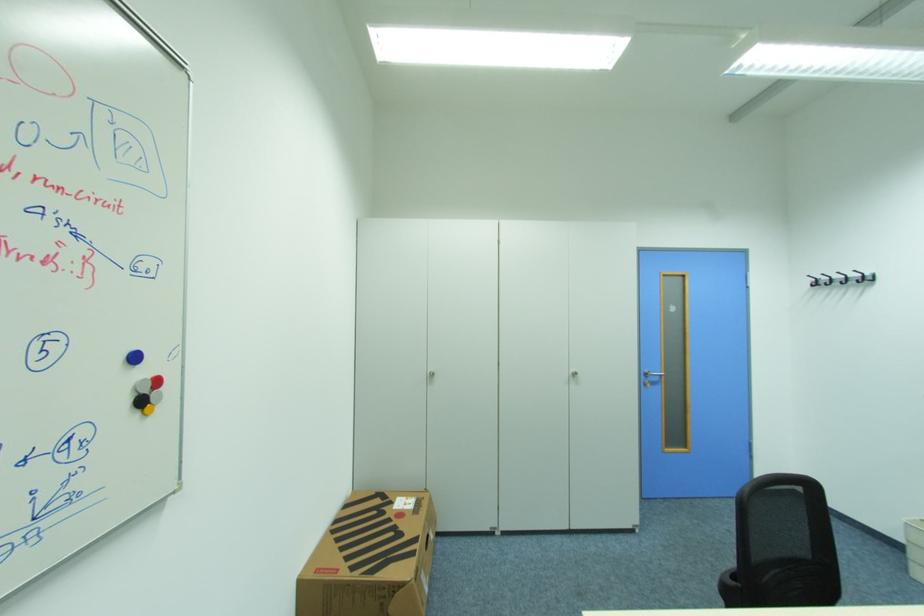
You are a GUI agent. You are given a task and a screenshot of the screen. Output one action in this format:
    pyautogui.click(x=<x>, y=<y>)
    Task: Click on the silver door handle
    This screenshot has height=616, width=924.
    Given the screenshot: What is the action you would take?
    650,377